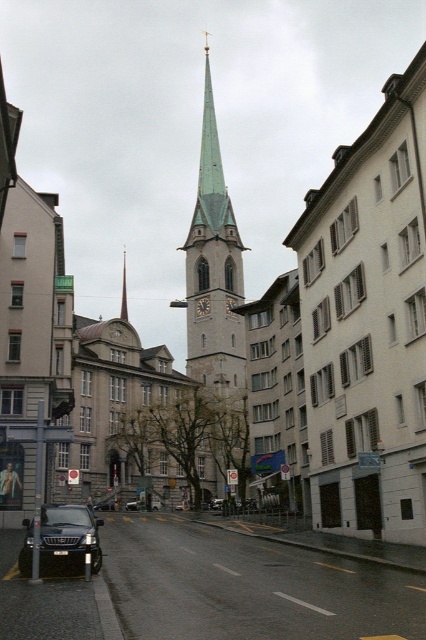
Question: Based on their relative distances, which object is nearer to the green stone spire at center?

Choices:
 (A) green stone clock tower at center
 (B) white smooth building at center
 (C) shiny black sedan at center
 (D) shiny black suv at lower left

Answer: (A)

Question: Can you confirm if shiny black suv at lower left is wider than green stone spire at center?

Choices:
 (A) no
 (B) yes

Answer: (A)

Question: Where is white smooth building at center located in relation to shiny black sedan at center in the image?

Choices:
 (A) below
 (B) above

Answer: (B)

Question: Considering the relative positions of shiny black suv at lower left and green stone spire at center in the image provided, where is shiny black suv at lower left located with respect to green stone spire at center?

Choices:
 (A) below
 (B) above

Answer: (A)

Question: Among these objects, which one is farthest from the camera?

Choices:
 (A) white smooth building at center
 (B) green stone clock tower at center
 (C) shiny black suv at lower left

Answer: (B)

Question: Which object appears farthest from the camera in this image?

Choices:
 (A) green stone spire at center
 (B) shiny black sedan at center
 (C) white smooth building at center

Answer: (A)